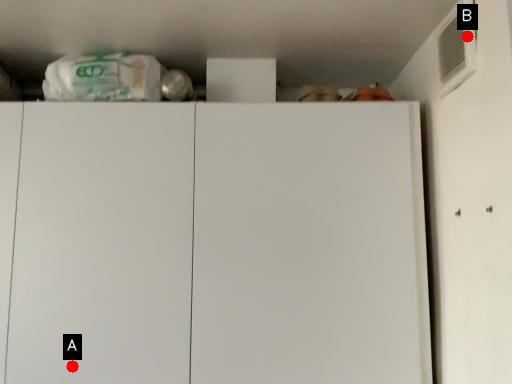
Question: Two points are circled on the image, labeled by A and B beside each circle. Which point is closer to the camera?

Choices:
 (A) A is closer
 (B) B is closer

Answer: (B)